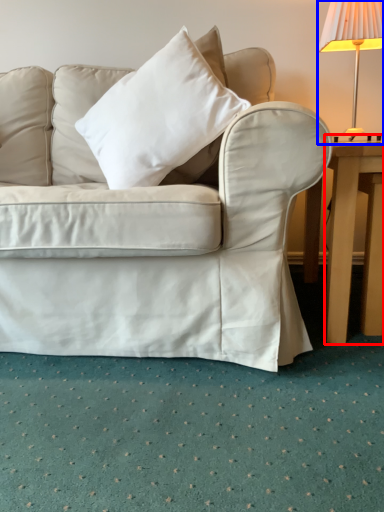
Question: Among these objects, which one is farthest to the camera, table (highlighted by a red box) or lamp (highlighted by a blue box)?

Choices:
 (A) table
 (B) lamp

Answer: (B)